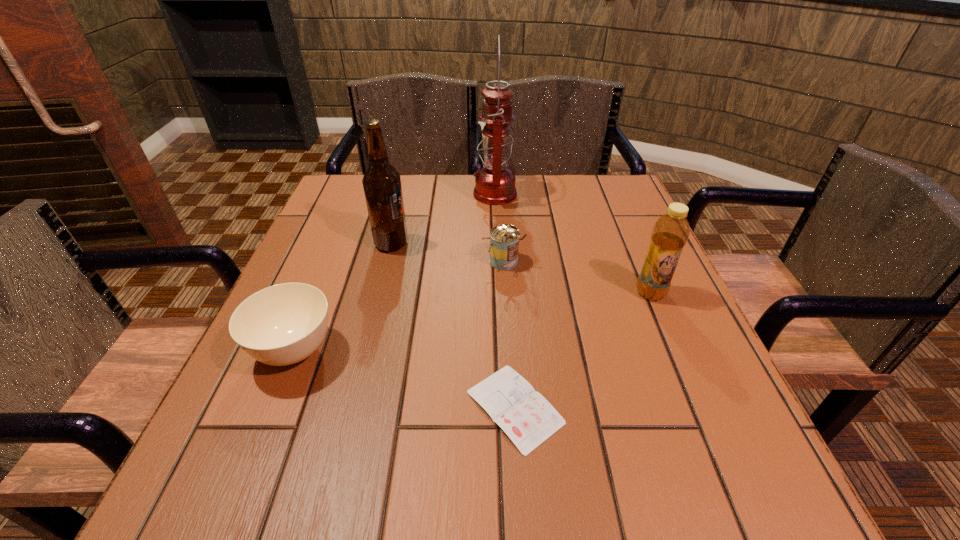
This screenshot has width=960, height=540. I want to click on vacant region that satisfies the following two spatial constraints: 1. on the label of the beer bottle; 2. on the left side of the shortest object, so click(350, 407).

Identify the location of vacant space that satisfies the following two spatial constraints: 1. on the back side of the farthest object; 2. on the left side of the fifth tallest object. [358, 193].

This screenshot has height=540, width=960. Identify the location of free space in the image that satisfies the following two spatial constraints: 1. on the label of the fifth shortest object; 2. on the back side of the shortest object. click(350, 407).